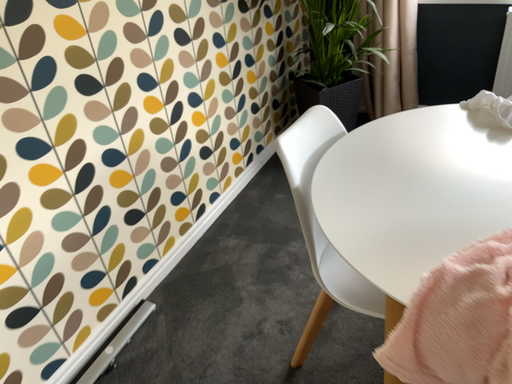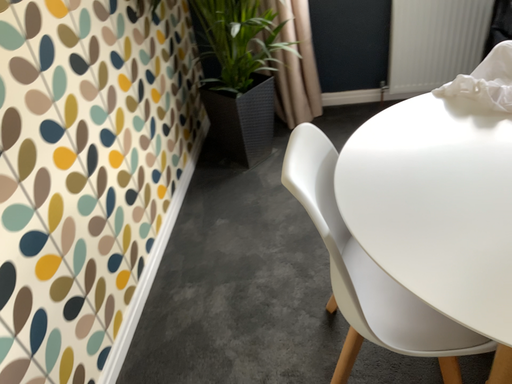
Question: Which way did the camera rotate in the video?

Choices:
 (A) rotated left
 (B) rotated right

Answer: (B)